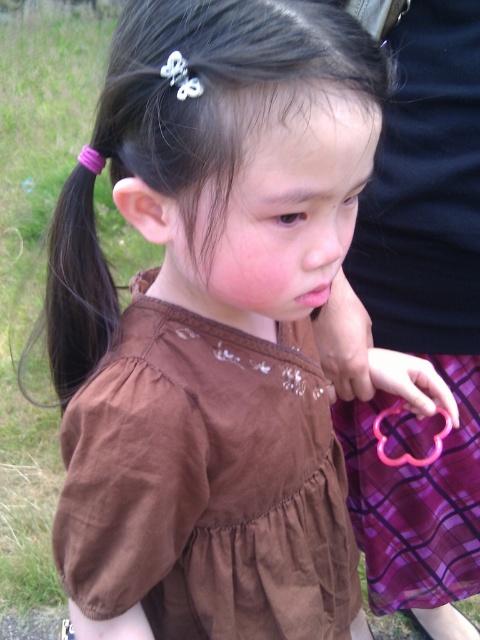
Is brown suede dress at center thinner than pink rubber band at lower right?

No.

Between brown suede dress at center and pink rubber band at lower right, which one appears on the left side from the viewer's perspective?

brown suede dress at center

Does point (163, 461) lie behind point (415, 358)?

No, (163, 461) is in front of (415, 358).

Locate an element on the screen. Image resolution: width=480 pixels, height=640 pixels. brown suede dress at center is located at coordinates (206, 483).

Which of these two, matte pink skin at lower right or pink plastic scissors at lower right, stands taller?

matte pink skin at lower right is taller.

Who is more forward, (340, 394) or (384, 436)?

Positioned in front is point (384, 436).

Who is more forward, (344,312) or (434,436)?

Point (344,312) is in front.

Locate an element on the screen. The height and width of the screenshot is (640, 480). matte pink skin at lower right is located at coordinates (345, 340).

Who is shorter, brown suede dress at center or purple elastic hairband at left?

purple elastic hairband at left is shorter.

Is point (335, 592) behind point (75, 273)?

Yes, it is.

Locate an element on the screen. brown suede dress at center is located at coordinates (206, 483).